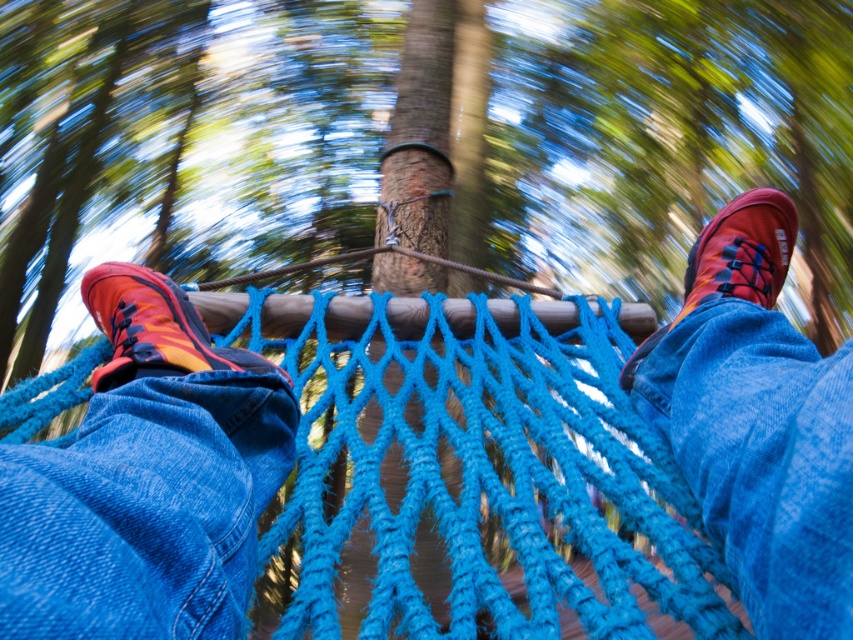
Question: Is orange and black hiking boot at lower left closer to camera compared to matte orange shoe at upper left?

Choices:
 (A) yes
 (B) no

Answer: (A)

Question: Which point is closer to the camera taking this photo?

Choices:
 (A) (251, 490)
 (B) (410, 358)
 (C) (769, 400)
 (D) (134, 365)

Answer: (C)

Question: Is blue yarn rope bridge at center closer to camera compared to orange and black hiking boot at lower left?

Choices:
 (A) no
 (B) yes

Answer: (A)

Question: Which point is closer to the camera?

Choices:
 (A) matte orange shoe at upper left
 (B) blue yarn rope bridge at center
 (C) orange and black hiking boot at lower left

Answer: (C)

Question: In this image, where is orange and black hiking boot at lower left located relative to matte orange shoe at left?

Choices:
 (A) right
 (B) left

Answer: (A)

Question: Among these objects, which one is nearest to the camera?

Choices:
 (A) matte orange shoe at upper right
 (B) blue yarn rope bridge at center
 (C) matte orange shoe at left

Answer: (B)